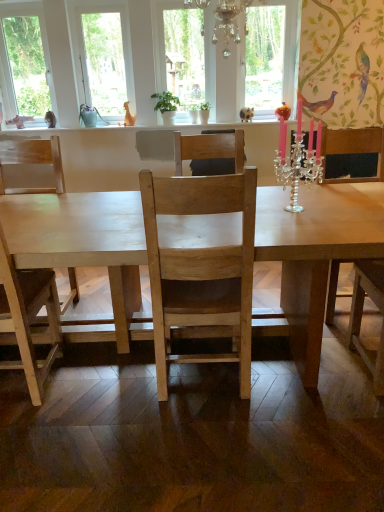
This screenshot has width=384, height=512. Find the location of `free space in front of silver/crystal candle holder at upper right`. free space in front of silver/crystal candle holder at upper right is located at coordinates (302, 225).